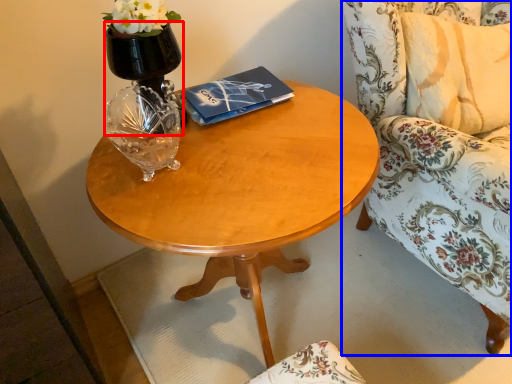
Question: Among these objects, which one is farthest to the camera, vase (highlighted by a red box) or chair (highlighted by a blue box)?

Choices:
 (A) vase
 (B) chair

Answer: (A)